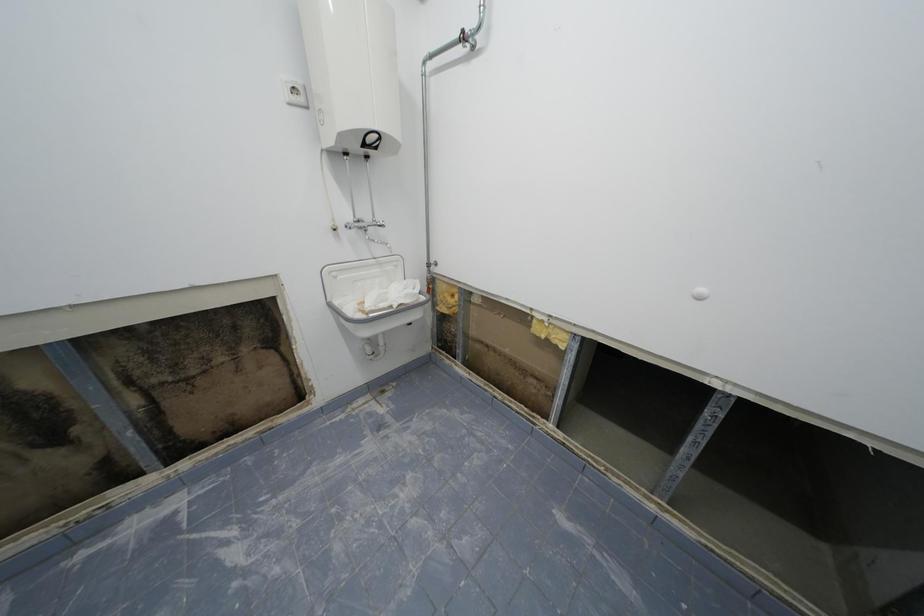
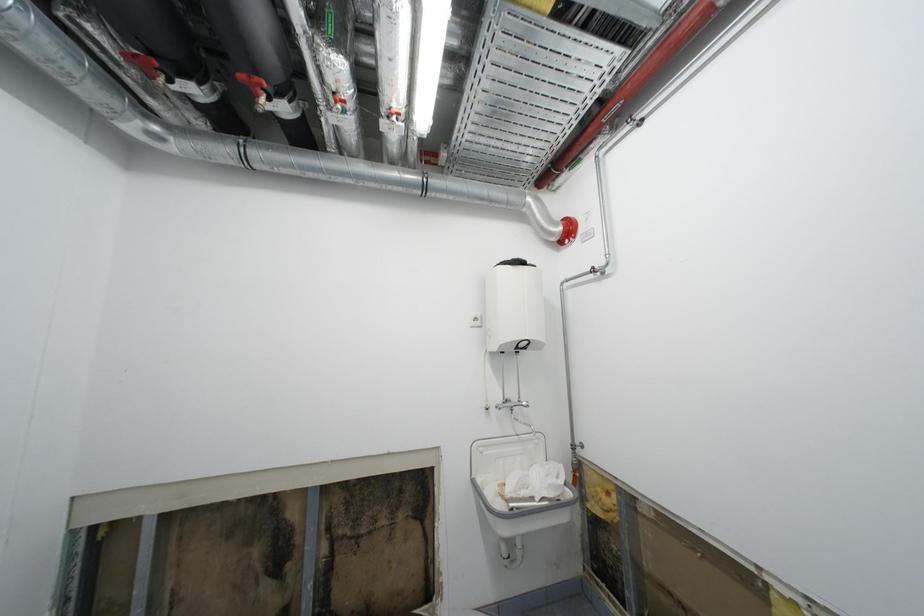
First-person continuous shooting, in which direction is the camera rotating?

The camera's rotation is toward left-up.